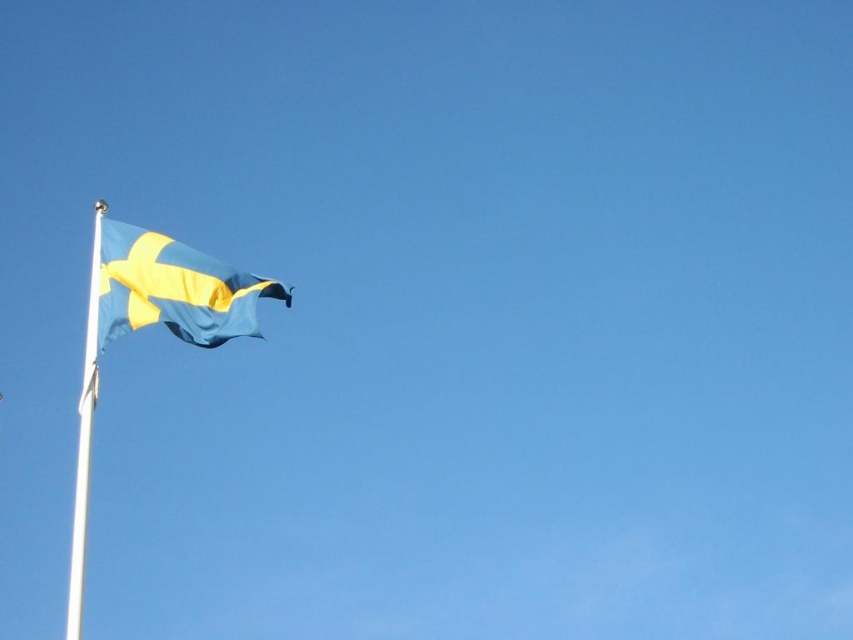
You are a photographer trying to capture the Swedish flag in the image. You want to ensure that both the blue fabric flag at upper left and the white metallic flag pole at left are clearly visible in your shot. Based on their positions, which object is closer to the center of the image?

The blue fabric flag at upper left is to the right of the white metallic flag pole at left, so the flag is closer to the center than the pole.

You are trying to determine the relative sizes of the blue fabric flag at upper left and the white metallic flag pole at left. Based on the scene, which object is narrower?

The blue fabric flag at upper left is narrower than the white metallic flag pole at left because its width is less than the pole.

From the picture: You are a photographer trying to capture the Swedish flag in the image. You want to ensure that both the blue fabric flag at upper left and the white metallic flag pole at left are clearly visible in your shot. Based on their positions, which object is higher in the frame?

The blue fabric flag at upper left is located above the white metallic flag pole at left, so it is higher in the frame.